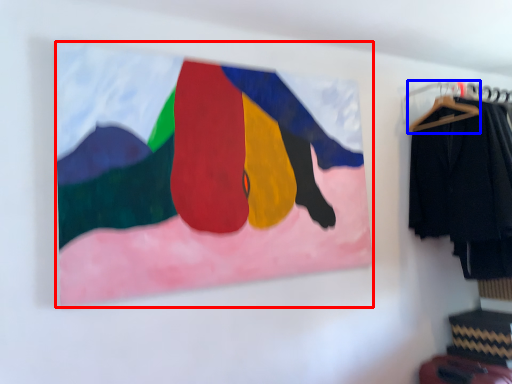
Question: Which point is closer to the camera, picture frame (highlighted by a red box) or hanger (highlighted by a blue box)?

Choices:
 (A) picture frame
 (B) hanger

Answer: (A)